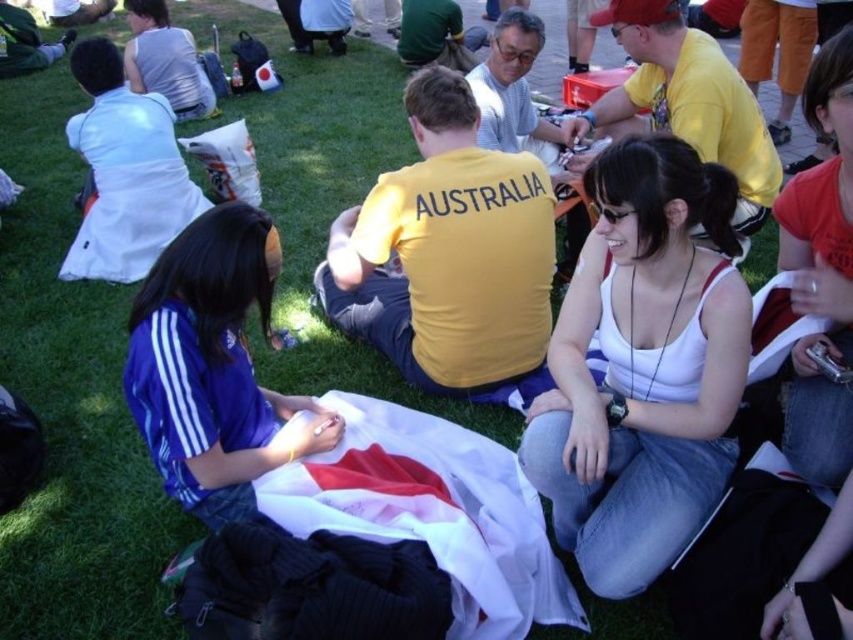
Is white fabric at center shorter than blue jersey at center?

No.

The image size is (853, 640). What do you see at coordinates (643, 368) in the screenshot?
I see `white fabric at center` at bounding box center [643, 368].

Where is `white fabric at center`? This screenshot has width=853, height=640. white fabric at center is located at coordinates (643, 368).